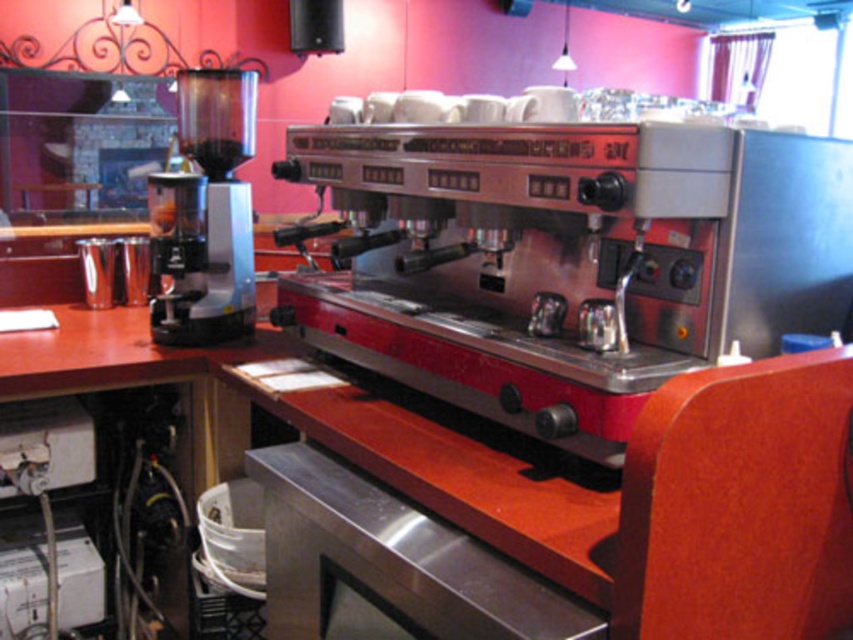
You are a barista standing at the counter and need to reach both the metallic espresso machine at center and the matte black coffee grinder at left. Which one will you have to reach further to access?

The matte black coffee grinder at left is further away from you than the metallic espresso machine at center, so you will have to reach further to access the matte black coffee grinder at left.

From the picture: You are a barista standing at the counter in front of the espresso machine. You need to reach a specific point marked at coordinates point (780, 330) to adjust a setting. If your arm can extend 1.2 meters, will you be able to comfortably reach that point without moving your position?

Answer: The distance of point (780, 330) from the viewer is 1.31 meters, which is slightly beyond the barista arm extension of 1.2 meters. Therefore, the barista would not be able to comfortably reach the point without moving.

You are a barista who needs to reach the top of the metallic espresso machine at center and the matte black coffee grinder at left. Which object will require you to stand on a stool to reach its top?

The matte black coffee grinder at left is taller than the metallic espresso machine at center, so you will need to stand on a stool to reach its top.